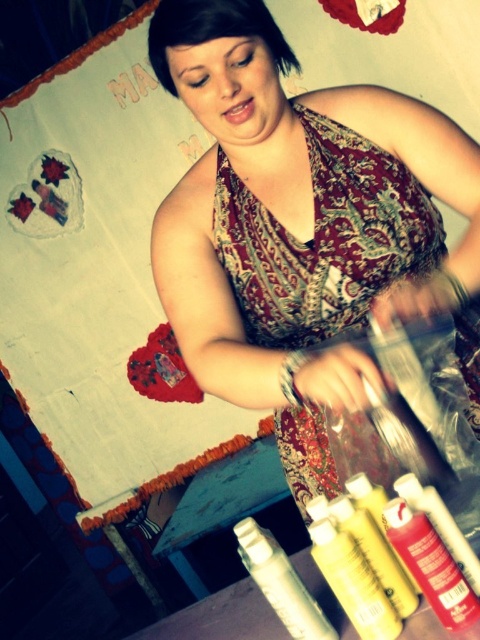
In the scene shown: What is located at the coordinates point [299,224]?

The point [299,224] corresponds to the matte floral dress at center.

You are an artist who needs to choose between the yellow matte paint at lower center and the yellow matte paint bottle at lower center for a detailed painting. Which one is narrower?

The yellow matte paint at lower center is narrower than the yellow matte paint bottle at lower center.

You are an artist who wants to place a new tool exactly at the center of the table. The table is located in front of you. Where should you place the new tool relative to the matte red spray can at lower right?

The center of the table is at point (240, 320). Since the matte red spray can at lower right is at point (431, 564), the new tool should be placed closer to the upper left compared to the matte red spray can at lower right.